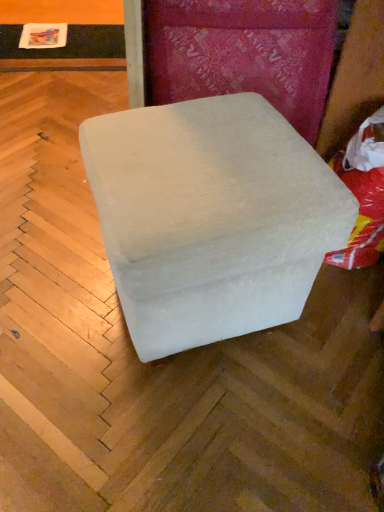
Locate an element on the screen. This screenshot has height=512, width=384. free location in front of white fabric ottoman at center is located at coordinates (184, 436).